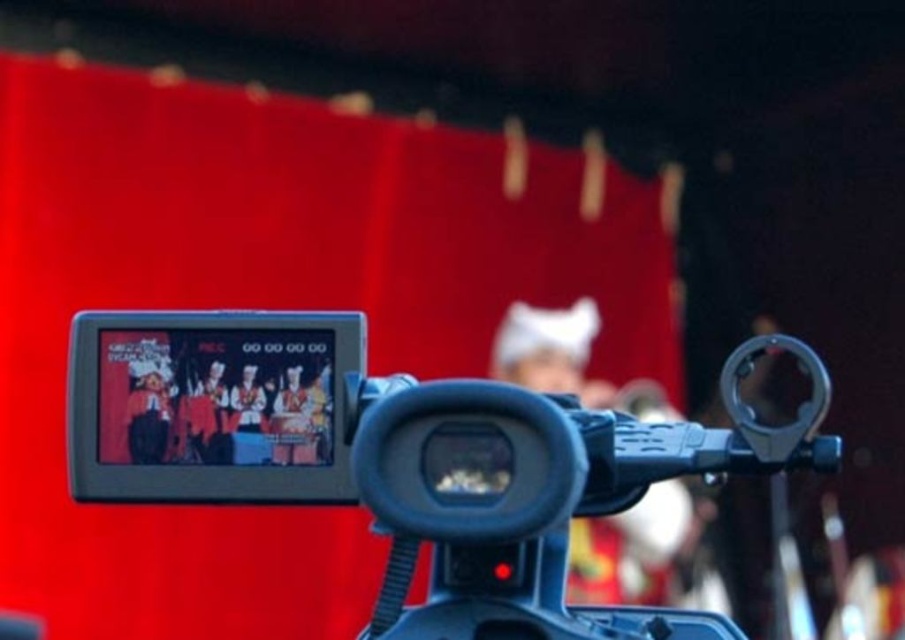
Is point (449, 454) in front of point (294, 396)?

Yes, it is.

Based on the photo, between black plastic video camera at center and matte black screen at center, which one has more height?

With more height is black plastic video camera at center.

Describe the element at coordinates (406, 458) in the screenshot. I see `black plastic video camera at center` at that location.

Identify the location of black plastic video camera at center. (406, 458).